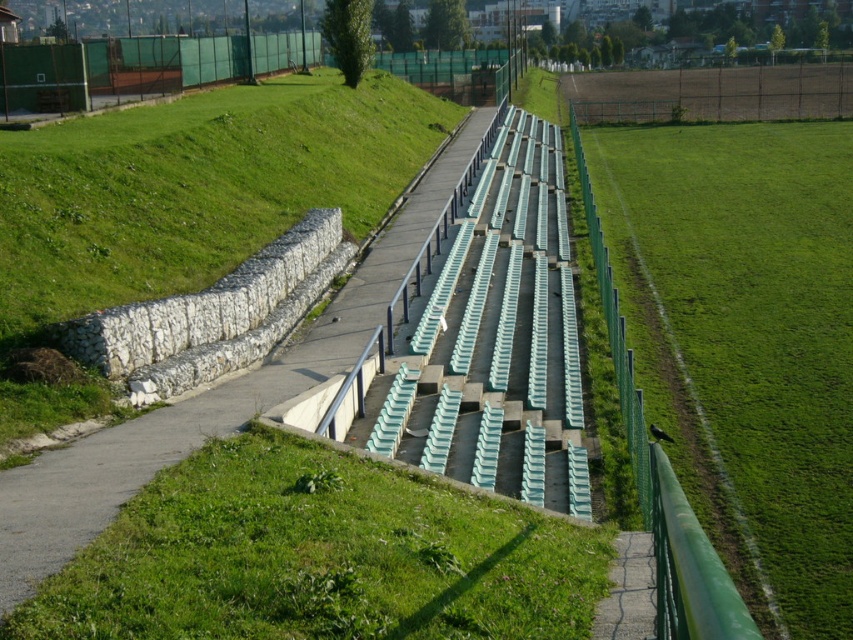
Question: Can you confirm if green grass at right is positioned to the right of concrete path at center?

Choices:
 (A) yes
 (B) no

Answer: (A)

Question: Which object is positioned closest to the green grassy at center?

Choices:
 (A) green grass at right
 (B) concrete path at center

Answer: (B)

Question: Is green grassy at center to the right of concrete path at center from the viewer's perspective?

Choices:
 (A) no
 (B) yes

Answer: (B)

Question: Which of the following is the farthest from the observer?

Choices:
 (A) green grassy at center
 (B) concrete path at center
 (C) green grass at right

Answer: (C)

Question: Which of the following is the farthest from the observer?

Choices:
 (A) green grass at right
 (B) green grassy at center

Answer: (A)

Question: Does green grassy at center lie behind concrete path at center?

Choices:
 (A) no
 (B) yes

Answer: (A)